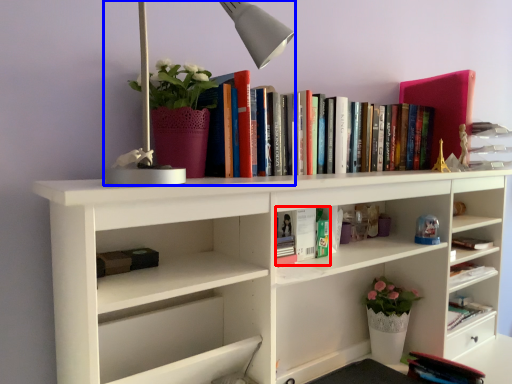
Question: Which object appears closest to the camera in this image, book (highlighted by a red box) or table lamp (highlighted by a blue box)?

Choices:
 (A) book
 (B) table lamp

Answer: (B)